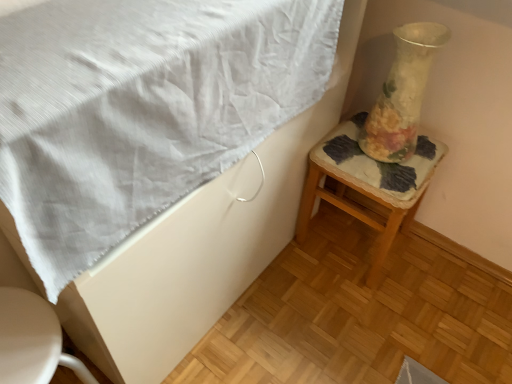
The height and width of the screenshot is (384, 512). I want to click on vacant position to the left of translucent glass vase at right, so click(344, 150).